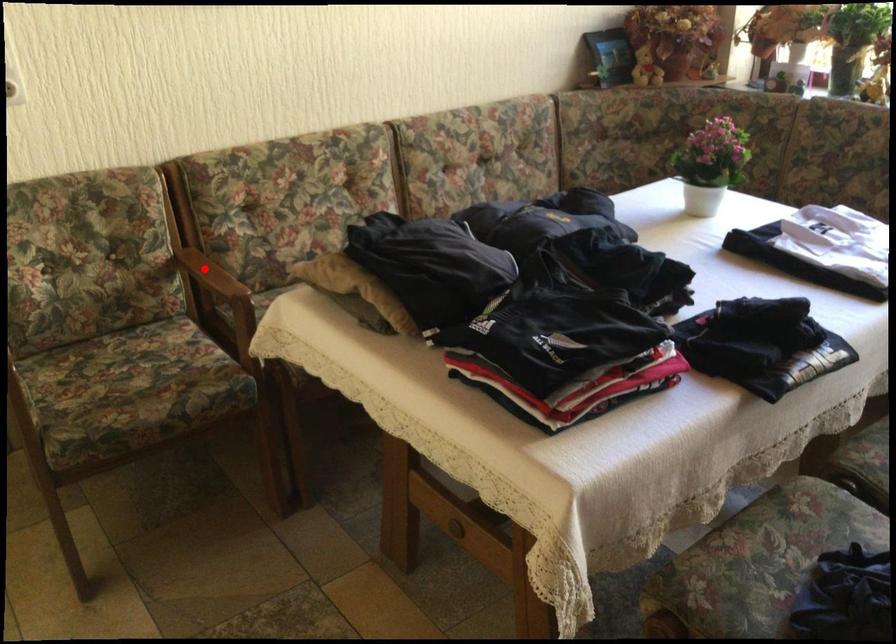
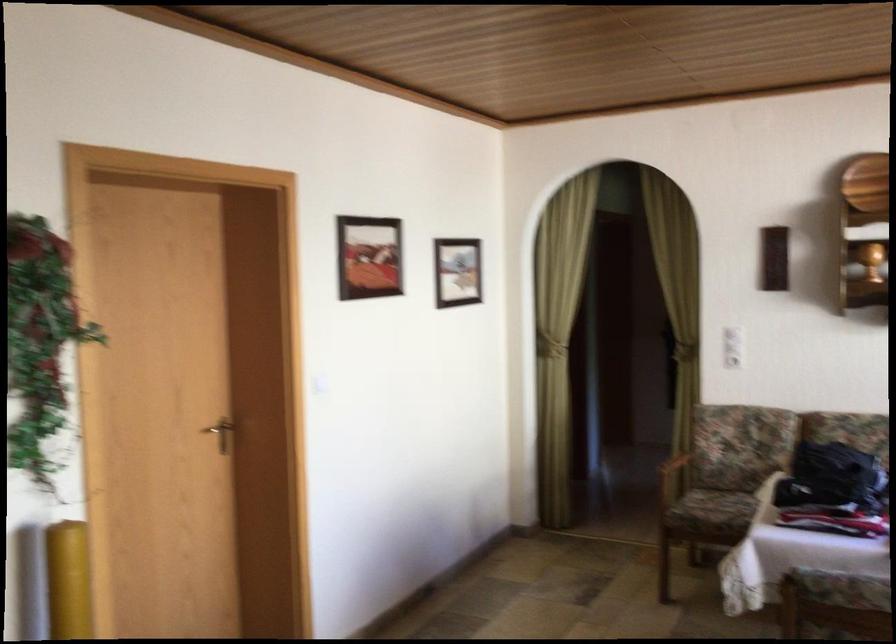
Question: I am providing you with two images of the same scene from different viewpoints. A red point is marked on the first image. At the location where the point appears in image 1, is it still visible in image 2?

Choices:
 (A) Yes
 (B) No

Answer: (B)